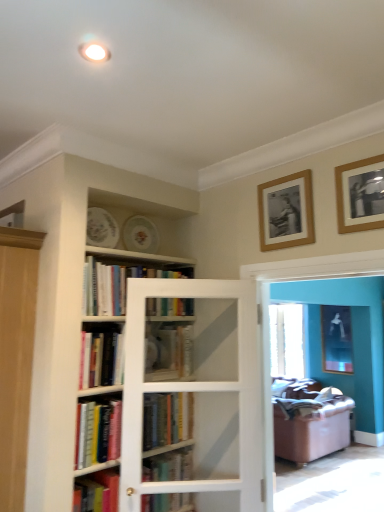
Question: In terms of width, does matte black picture frame at upper right, the third picture frame positioned from the front, look wider or thinner when compared to hardcover book at center, placed as the fourth book when sorted from bottom to top?

Choices:
 (A) wide
 (B) thin

Answer: (B)

Question: Does point (334, 309) appear closer or farther from the camera than point (180, 373)?

Choices:
 (A) closer
 (B) farther

Answer: (B)

Question: Estimate the real-world distances between objects in this image. Which object is farther from the matte glass screen door at center, marked as the second screen door in a left-to-right arrangement?

Choices:
 (A) hardcover books at upper center, which is the 1th book from top to bottom
 (B) hardcover book at center, the 3th book positioned from the top
 (C) hardcover book at center, which is the 5th book from top to bottom
 (D) white glass cabinet at center, marked as the second screen door in a right-to-left arrangement
 (E) hardcover books at center, placed as the fifth book when sorted from bottom to top

Answer: (E)

Question: Which is nearer to the hardcover book at center, the sixth book from the top?

Choices:
 (A) matte glass screen door at center, marked as the 1th screen door in a right-to-left arrangement
 (B) hardcover book at lower left, marked as the 3th book in a bottom-to-top arrangement
 (C) hardcover books at center, acting as the 2th book starting from the top
 (D) hardcover books at upper center, which is the 1th book from top to bottom
 (E) hardcover book at center, placed as the fourth book when sorted from bottom to top

Answer: (B)